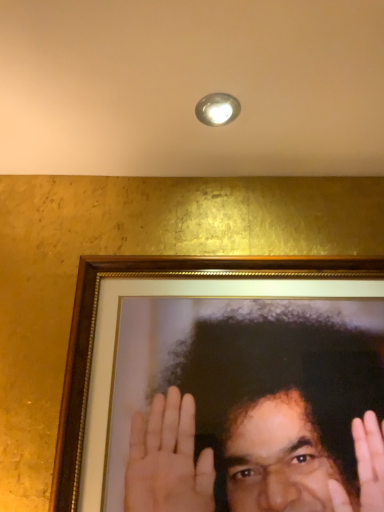
Question: Is metallic dome at upper center spatially inside smooth gold frame at center, or outside of it?

Choices:
 (A) inside
 (B) outside

Answer: (B)

Question: In terms of size, does metallic dome at upper center appear bigger or smaller than smooth gold frame at center?

Choices:
 (A) small
 (B) big

Answer: (A)

Question: Considering the positions of point click(226, 117) and point click(233, 501), is point click(226, 117) closer or farther from the camera than point click(233, 501)?

Choices:
 (A) closer
 (B) farther

Answer: (B)

Question: From a real-world perspective, is smooth gold frame at center physically located above or below metallic dome at upper center?

Choices:
 (A) above
 (B) below

Answer: (B)

Question: From the image's perspective, is smooth gold frame at center above or below metallic dome at upper center?

Choices:
 (A) above
 (B) below

Answer: (B)

Question: Is point (190, 418) closer or farther from the camera than point (235, 109)?

Choices:
 (A) closer
 (B) farther

Answer: (A)

Question: Would you say smooth gold frame at center is to the left or to the right of metallic dome at upper center in the picture?

Choices:
 (A) right
 (B) left

Answer: (A)